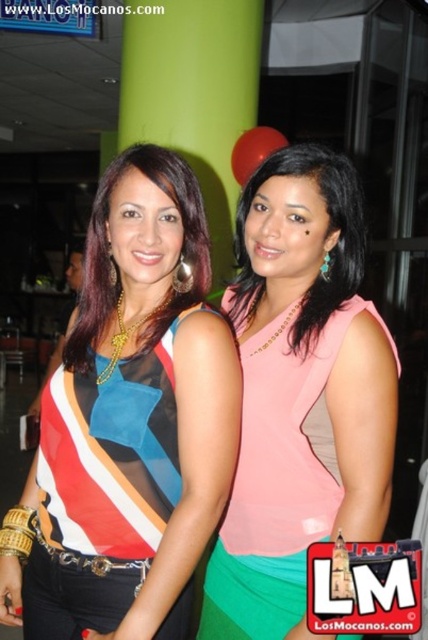
Can you confirm if pink fabric dress at center is positioned below pink matte dress at center?

Correct, pink fabric dress at center is located below pink matte dress at center.

Which is more to the right, pink fabric dress at center or pink matte dress at center?

→ From the viewer's perspective, pink matte dress at center appears more on the right side.

Is point (368, 353) more distant than point (252, 179)?

No, (368, 353) is closer to viewer.

The width and height of the screenshot is (428, 640). What are the coordinates of `pink fabric dress at center` in the screenshot? It's located at (299, 392).

Can you confirm if multicolored sheer top at center is positioned to the right of pink matte dress at center?

Incorrect, multicolored sheer top at center is not on the right side of pink matte dress at center.

Can you confirm if multicolored sheer top at center is taller than pink matte dress at center?

Indeed, multicolored sheer top at center has a greater height compared to pink matte dress at center.

Which is behind, point (68, 484) or point (309, 160)?

The point (309, 160) is behind.

This screenshot has height=640, width=428. I want to click on multicolored sheer top at center, so click(x=139, y=400).

Image resolution: width=428 pixels, height=640 pixels. Describe the element at coordinates (139, 400) in the screenshot. I see `multicolored sheer top at center` at that location.

This screenshot has height=640, width=428. I want to click on multicolored sheer top at center, so click(139, 400).

Who is more forward, (x=134, y=376) or (x=356, y=392)?

Positioned in front is point (x=356, y=392).

Find the location of `multicolored sheer top at center`. multicolored sheer top at center is located at coordinates (139, 400).